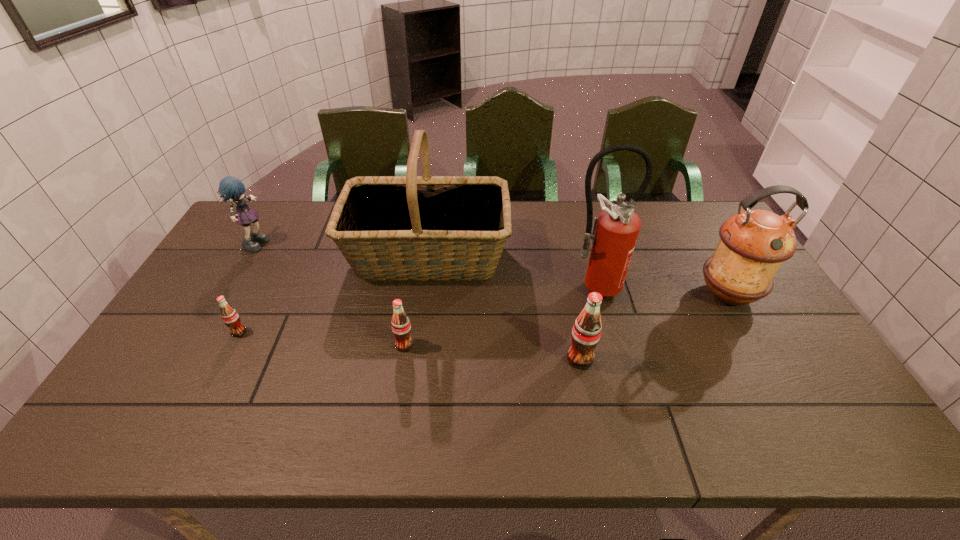
Image resolution: width=960 pixels, height=540 pixels. I want to click on vacant spot to place a soda on the right, so click(766, 374).